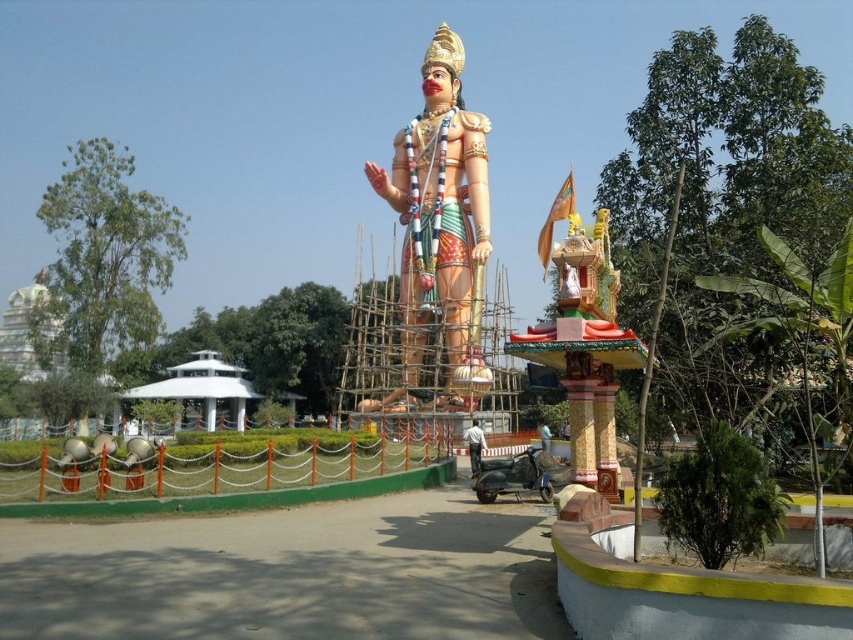
Is point (463, 116) positioned before point (469, 451)?

That is False.

Is point (454, 342) behind point (474, 422)?

Yes.

Locate an element on the screen. matte plastic statue at center is located at coordinates (440, 224).